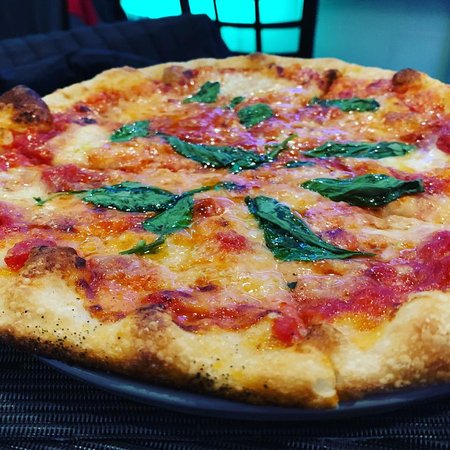
Find the location of a particular element. This screenshot has height=450, width=450. placemat under pizza is located at coordinates (36, 409), (420, 421).